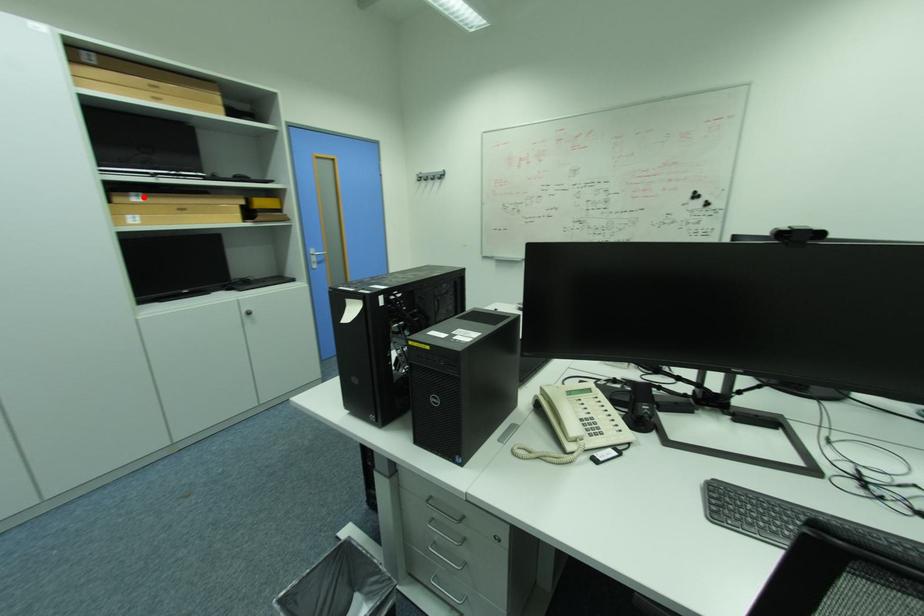
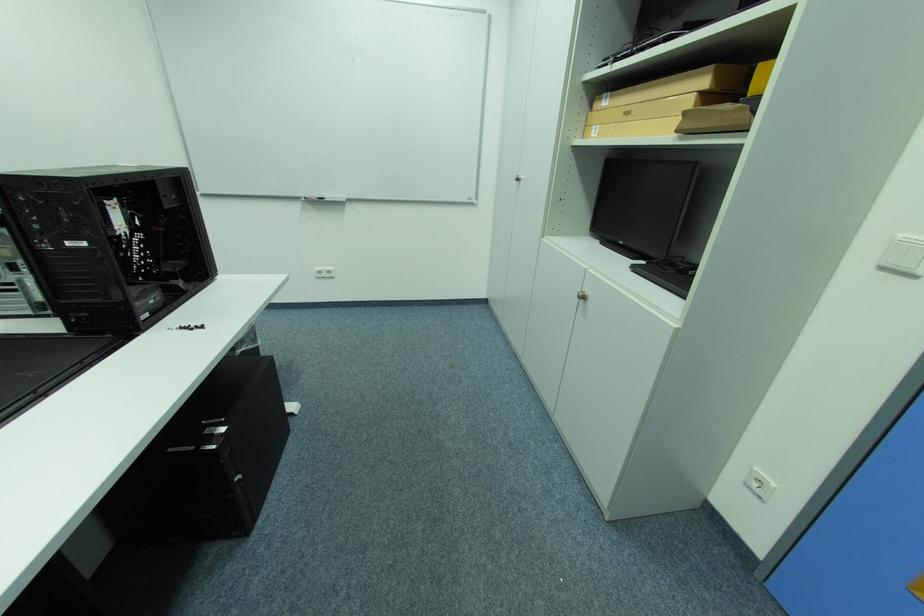
Locate, in the second image, the point that corresponds to the highlighted location in the first image.

(614, 98)